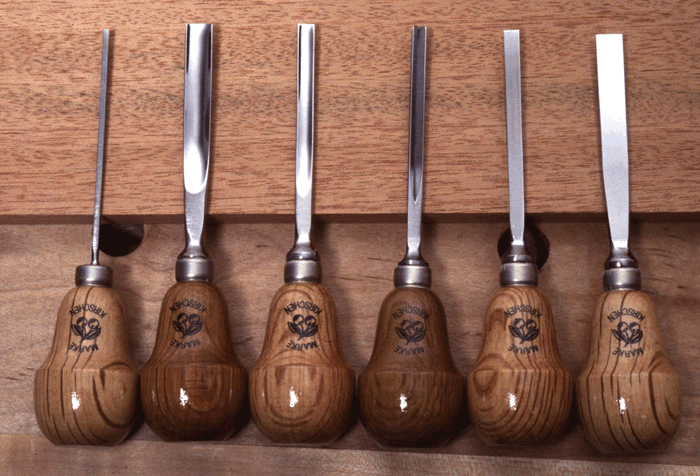
This screenshot has width=700, height=476. What are the coordinates of `wood surface` in the screenshot? It's located at (364, 90).